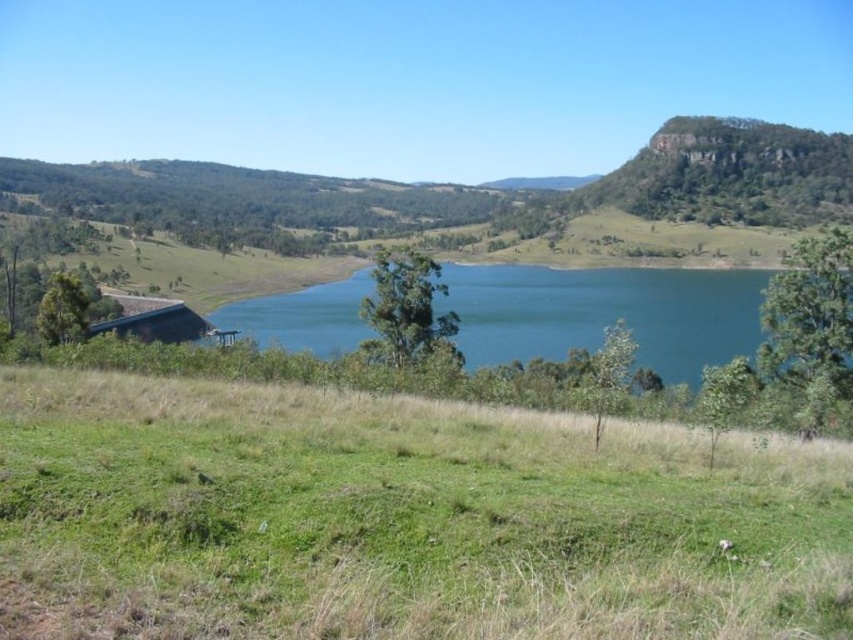
You are standing on the grassy area in front of the blue water at center. You want to throw a stone to reach the far end of the lake. The stone can travel 40 meters. Will it reach the far end?

The blue water at center is 41.66 meters away from the viewer. Since the stone can only travel 40 meters, it will not reach the far end of the lake.

You are standing at the edge of the lake and want to reach the point marked as point (36, 552). There is another point, point (125, 301), further away. Which point should you aim for if you want to get closer to the viewer?

You should aim for point (36, 552) because it is closer to the viewer than point (125, 301).